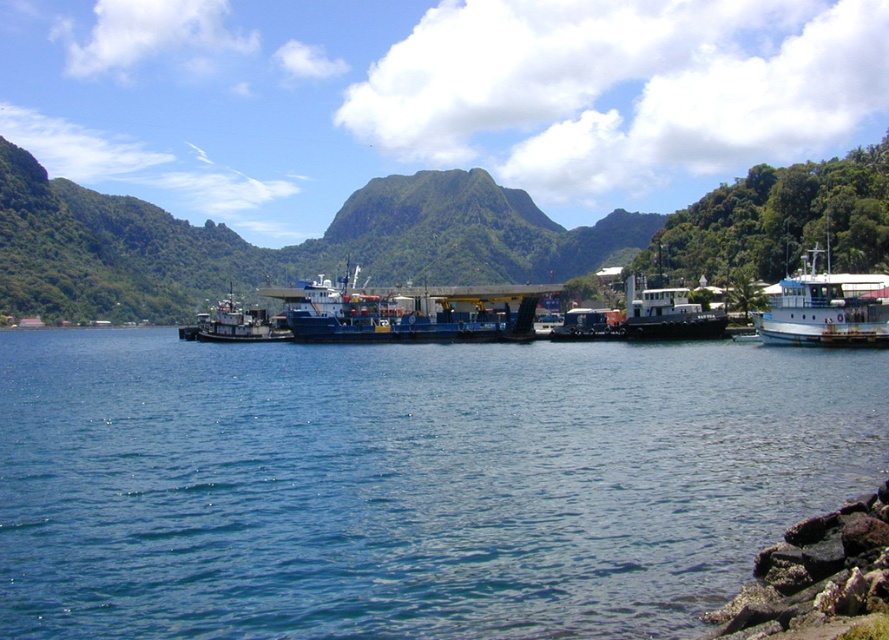
Can you confirm if blue matte tugboat at center is positioned to the left of brushed metal tugboat at left?

Incorrect, blue matte tugboat at center is not on the left side of brushed metal tugboat at left.

This screenshot has width=889, height=640. I want to click on blue matte tugboat at center, so click(x=645, y=317).

Is point (709, 326) in front of point (244, 340)?

Yes, point (709, 326) is closer to viewer.

I want to click on blue matte tugboat at center, so click(x=645, y=317).

Is blue matte cargo ship at center shorter than white matte boat at right?

No, blue matte cargo ship at center is not shorter than white matte boat at right.

Which is behind, point (399, 316) or point (813, 252)?

The point (399, 316) is behind.

Find the location of a particular element. This screenshot has width=889, height=640. blue matte cargo ship at center is located at coordinates pyautogui.click(x=407, y=310).

Describe the element at coordinates (407, 310) in the screenshot. The image size is (889, 640). I see `blue matte cargo ship at center` at that location.

Which of these two, blue matte cargo ship at center or brushed metal tugboat at left, stands shorter?

blue matte cargo ship at center is shorter.

What do you see at coordinates (407, 310) in the screenshot? The image size is (889, 640). I see `blue matte cargo ship at center` at bounding box center [407, 310].

The height and width of the screenshot is (640, 889). Find the location of `blue matte cargo ship at center`. blue matte cargo ship at center is located at coordinates (407, 310).